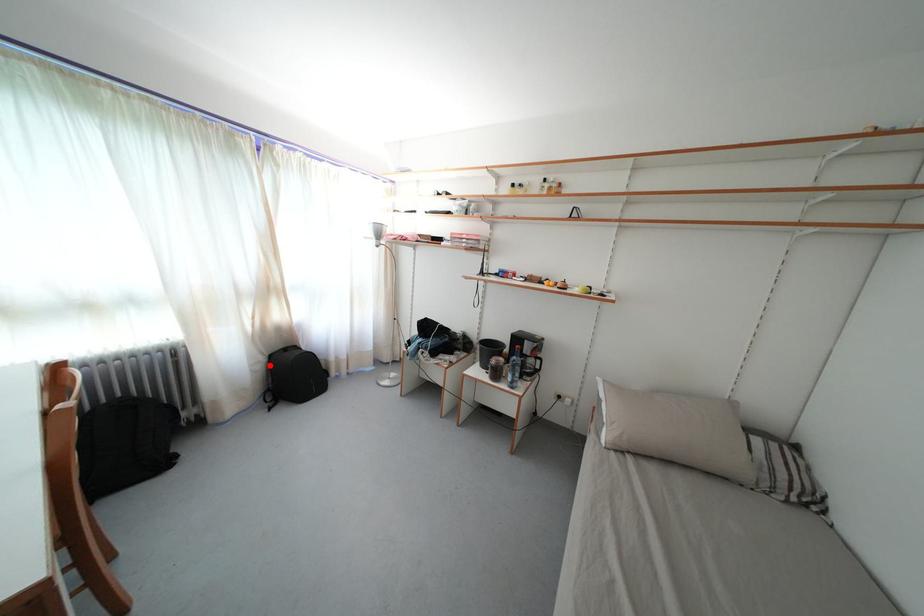
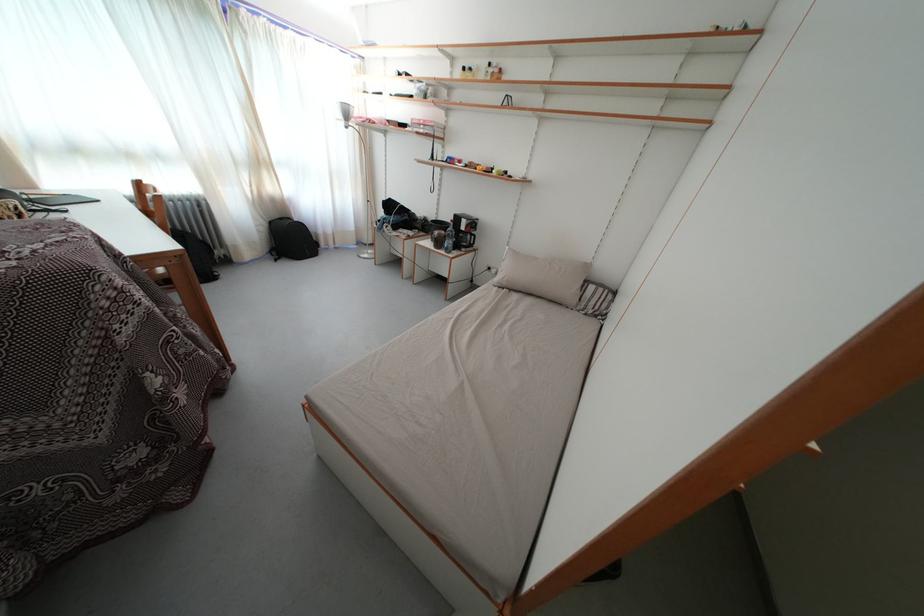
Question: I am providing you with two images of the same scene from different viewpoints. Given a red point in image1, look at the same physical point in image2. Is it:

Choices:
 (A) Closer to the viewpoint
 (B) Farther from the viewpoint

Answer: (A)